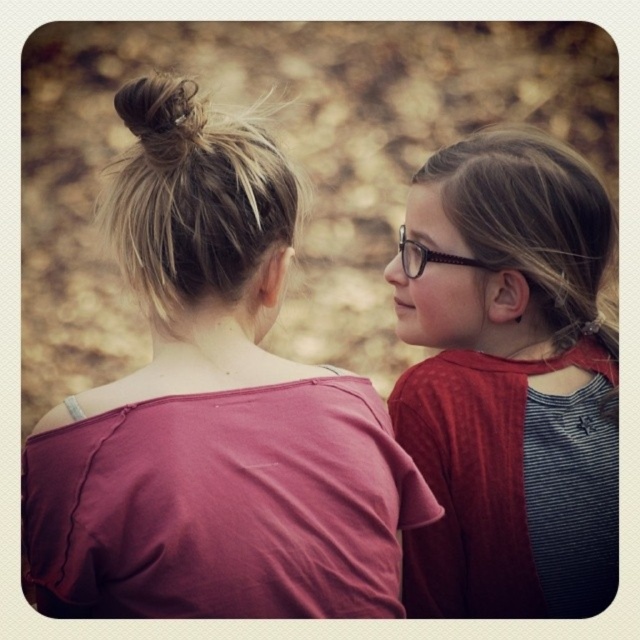
Question: Which point is closer to the camera?

Choices:
 (A) (467, 221)
 (B) (177, 120)
 (C) (148, 288)

Answer: (B)

Question: Estimate the real-world distances between objects in this image. Which object is farther from the blonde hair at upper right?

Choices:
 (A) brown hair bun at upper left
 (B) matte pink shirt at upper left

Answer: (A)

Question: Which object is the farthest from the brown hair bun at upper left?

Choices:
 (A) blondehair at upper left
 (B) matte pink shirt at upper left
 (C) blonde hair at upper right
 (D) matte brown hair at upper right

Answer: (D)

Question: Can you confirm if matte brown hair at upper right is positioned below blonde hair at upper right?

Choices:
 (A) yes
 (B) no

Answer: (A)

Question: Does matte pink shirt at upper left have a greater width compared to blonde hair at upper right?

Choices:
 (A) yes
 (B) no

Answer: (A)

Question: Is matte pink shirt at upper left above brown hair bun at upper left?

Choices:
 (A) no
 (B) yes

Answer: (A)